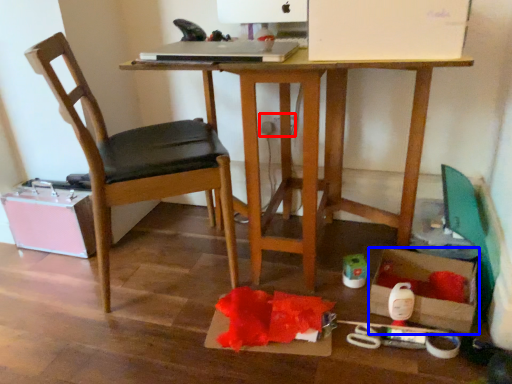
Question: Which object is closer to the camera taking this photo, power plugs and sockets (highlighted by a red box) or storage box (highlighted by a blue box)?

Choices:
 (A) power plugs and sockets
 (B) storage box

Answer: (B)